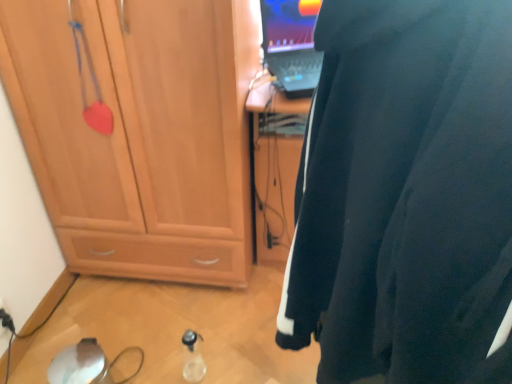
Question: Visually, is transparent plastic bottle at lower center positioned to the left or to the right of black plastic electric outlet at lower left?

Choices:
 (A) right
 (B) left

Answer: (A)

Question: Does point (189, 362) appear closer or farther from the camera than point (10, 327)?

Choices:
 (A) closer
 (B) farther

Answer: (A)

Question: Based on their relative distances, which object is farther from the matte wood cabinet at left?

Choices:
 (A) black plastic electric outlet at lower left
 (B) transparent plastic bottle at lower center
 (C) black fabric wetsuit at right

Answer: (C)

Question: Which is farther from the black plastic electric outlet at lower left?

Choices:
 (A) black fabric wetsuit at right
 (B) matte wood cabinet at left
 (C) transparent plastic bottle at lower center

Answer: (A)